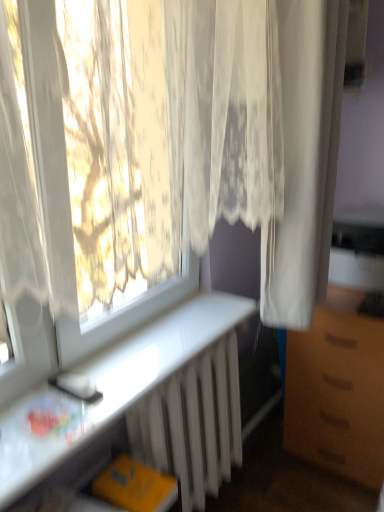
Question: Is white lace curtain at upper left, which ranks as the 1th curtain in left-to-right order, to the left or to the right of white sheer curtain at right, positioned as the second curtain in left-to-right order, in the image?

Choices:
 (A) left
 (B) right

Answer: (A)

Question: Based on their sizes in the image, would you say white lace curtain at upper left, acting as the second curtain starting from the right, is bigger or smaller than white sheer curtain at right, positioned as the 1th curtain in right-to-left order?

Choices:
 (A) small
 (B) big

Answer: (B)

Question: Based on their relative distances, which object is farther from the white lace curtain at upper left, acting as the second curtain starting from the right?

Choices:
 (A) white glossy desk at lower left
 (B) brown matte cabinet at right
 (C) white metallic radiator at lower center
 (D) white sheer curtain at right, positioned as the second curtain in left-to-right order

Answer: (B)

Question: Estimate the real-world distances between objects in this image. Which object is farther from the white glossy desk at lower left?

Choices:
 (A) white lace curtain at upper left, acting as the second curtain starting from the right
 (B) white sheer curtain at right, positioned as the 1th curtain in right-to-left order
 (C) white metallic radiator at lower center
 (D) brown matte cabinet at right

Answer: (A)